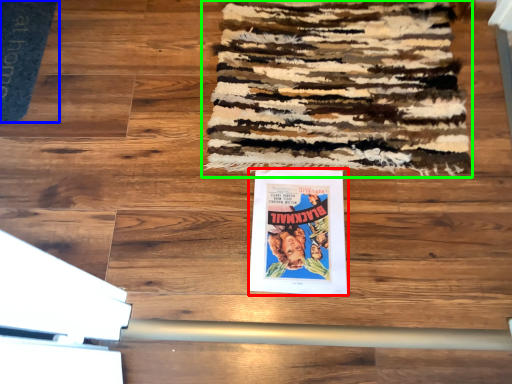
Question: Which is farther away from poster (highlighted by a red box)? doormat (highlighted by a blue box) or mat (highlighted by a green box)?

Choices:
 (A) doormat
 (B) mat

Answer: (A)